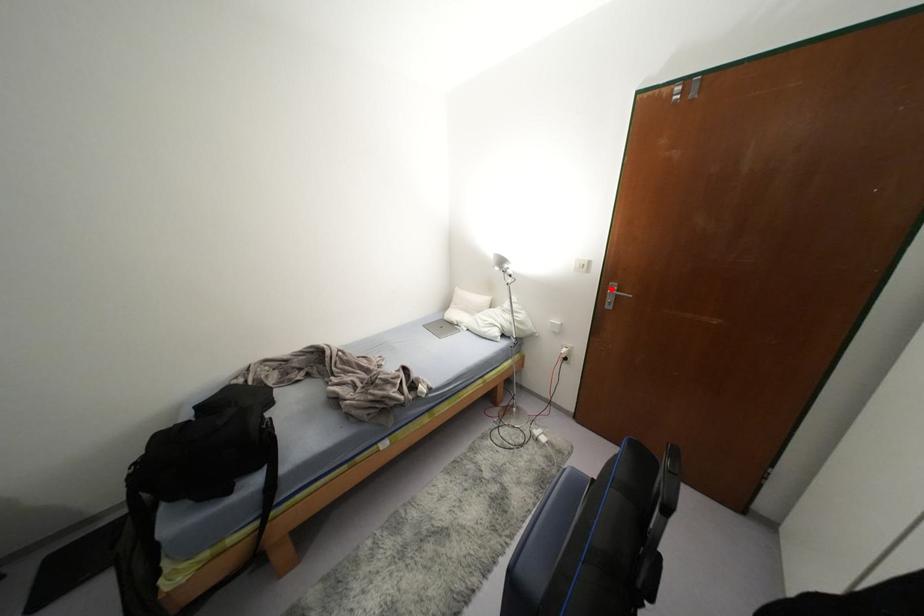
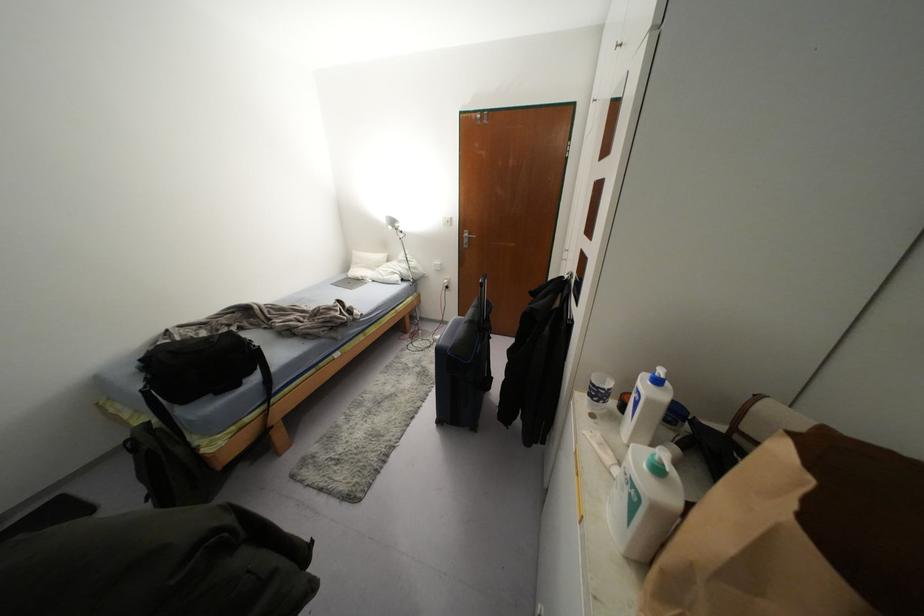
The point at the highlighted location is marked in the first image. Where is the corresponding point in the second image?

(465, 233)